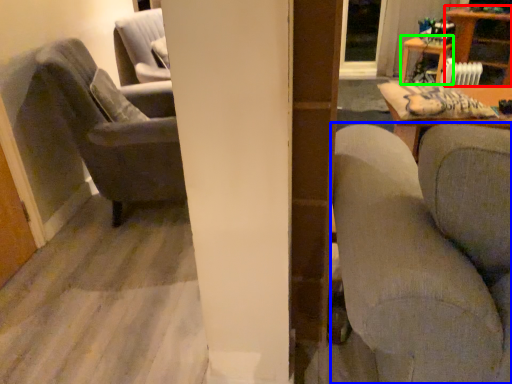
Question: Based on their relative distances, which object is nearer to table (highlighted by a red box)? Choose from studio couch (highlighted by a blue box) and table (highlighted by a green box).

Choices:
 (A) studio couch
 (B) table

Answer: (B)